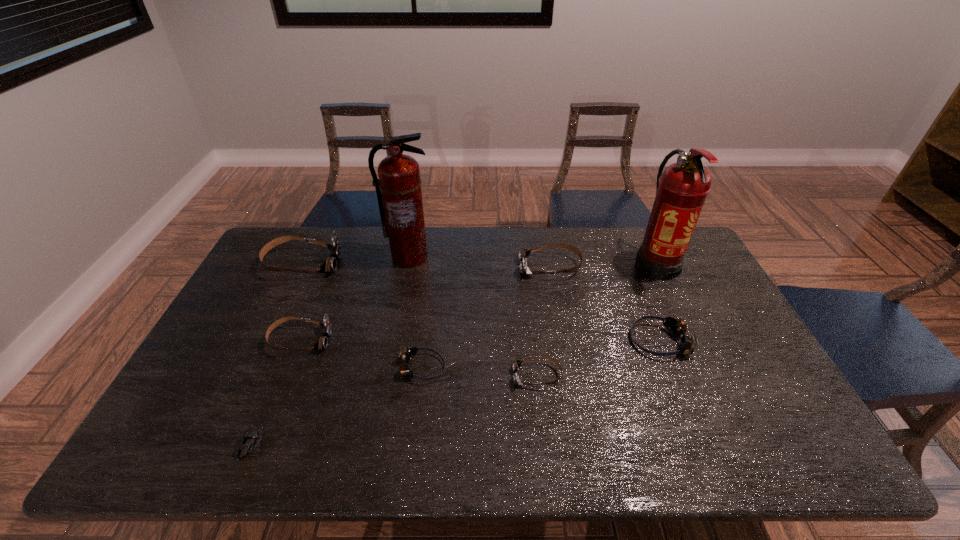
You are a GUI agent. You are given a task and a screenshot of the screen. Output one action in this format:
    pyautogui.click(x=<x>, y=<y>)
    Task: Click on the object present at the right edge
    Image resolution: width=960 pixels, height=540 pixels.
    Given the screenshot: What is the action you would take?
    pyautogui.click(x=681, y=190)

At what (x,y) coordinates should I click in order to perform the action: click on object positioned at the far left corner. Please return your answer as a coordinate pair (x, y). Image resolution: width=960 pixels, height=540 pixels. Looking at the image, I should click on (330, 264).

Find the location of a particular element. This screenshot has height=540, width=960. object at the far right corner is located at coordinates (681, 190).

Where is `free space at the far edge`? Image resolution: width=960 pixels, height=540 pixels. free space at the far edge is located at coordinates (572, 227).

Locate an element on the screen. Image resolution: width=960 pixels, height=540 pixels. vacant space at the near edge of the desktop is located at coordinates (503, 430).

Locate an element on the screen. The height and width of the screenshot is (540, 960). vacant space at the left edge is located at coordinates (288, 289).

In the image, there is a desktop. What are the coordinates of `blank space at the right edge` in the screenshot? It's located at (681, 279).

Find the location of a particular element. vacant region at the far left corner of the desktop is located at coordinates (311, 238).

You are a GUI agent. You are given a task and a screenshot of the screen. Output one action in this format:
    pyautogui.click(x=<x>, y=<y>)
    Task: Click on the vacant point located between the shortest object and the left fire extinguisher
    
    Given the screenshot: What is the action you would take?
    pyautogui.click(x=329, y=351)

The width and height of the screenshot is (960, 540). What are the coordinates of `empty space that is in between the biggest brown goggles and the right bronze goggles` in the screenshot? It's located at (481, 302).